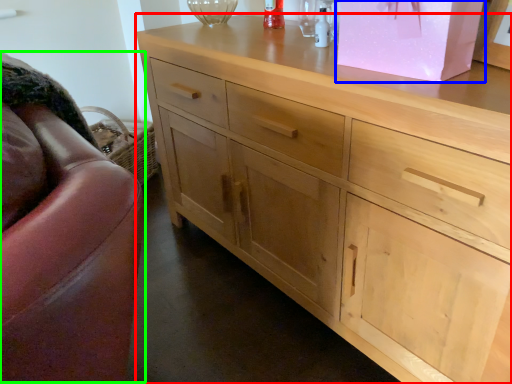
Question: Which object is the closest to the chest of drawers (highlighted by a red box)? Choose among these: cabinetry (highlighted by a blue box) or swivel chair (highlighted by a green box).

Choices:
 (A) cabinetry
 (B) swivel chair

Answer: (A)